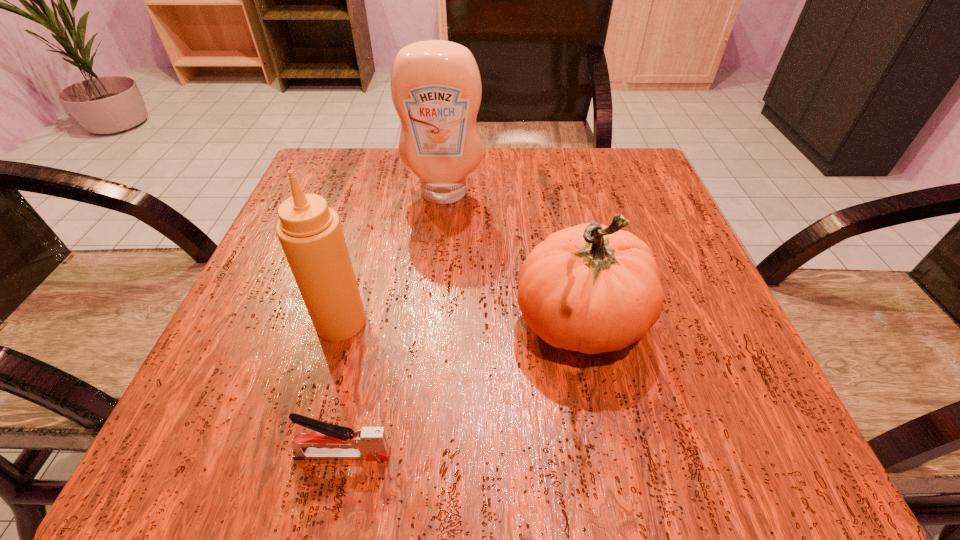
Where is `the farthest object`? the farthest object is located at coordinates (436, 89).

You are a GUI agent. You are given a task and a screenshot of the screen. Output one action in this format:
    pyautogui.click(x=<x>, y=<y>)
    Task: Click on the right condiment
    This screenshot has width=960, height=540.
    Given the screenshot: What is the action you would take?
    pyautogui.click(x=436, y=89)

Image resolution: width=960 pixels, height=540 pixels. I want to click on the rightmost object, so click(x=592, y=288).

Locate an element on the screen. This screenshot has width=960, height=540. the nearer condiment is located at coordinates (310, 233).

Find the location of `stapler`. stapler is located at coordinates (328, 441).

Identify the location of the shortest object. The width and height of the screenshot is (960, 540). (328, 441).

At what (x,y) coordinates should I click in order to perform the action: click on vacant position located 0.120m on the label of the farther condiment. Please return your answer as a coordinate pair (x, y). This screenshot has height=540, width=960. Looking at the image, I should click on (439, 245).

Where is `vacant space situated on the left of the rightmost object`? vacant space situated on the left of the rightmost object is located at coordinates (264, 326).

Locate an element on the screen. The width and height of the screenshot is (960, 540). vacant area situated on the back of the left condiment is located at coordinates (375, 202).

Locate an element on the screen. This screenshot has height=540, width=960. vacant area located on the handle side of the nearest object is located at coordinates (610, 455).